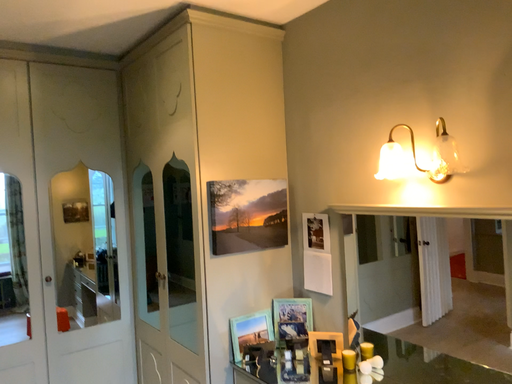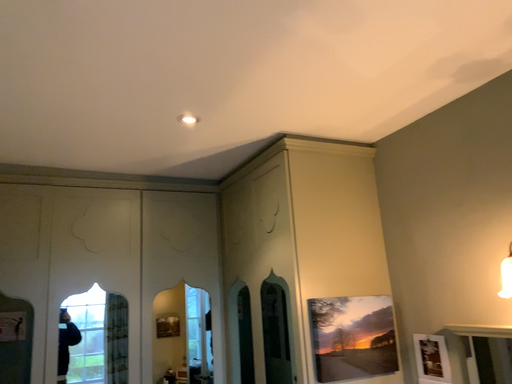
Question: Which way did the camera rotate in the video?

Choices:
 (A) rotated left
 (B) rotated right

Answer: (A)